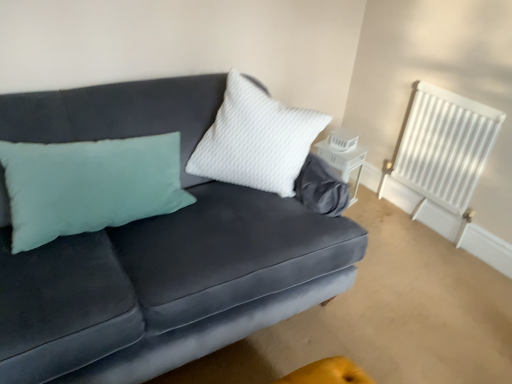
Locate an element on the screen. Image resolution: width=512 pixels, height=384 pixels. free area in between white painted metal radiator at upper right and white matte lantern at center is located at coordinates (383, 214).